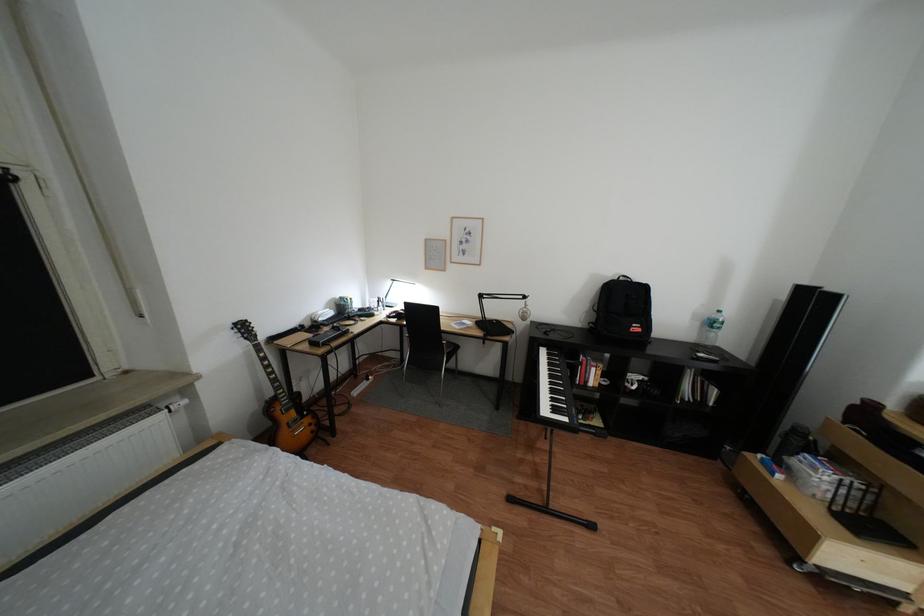
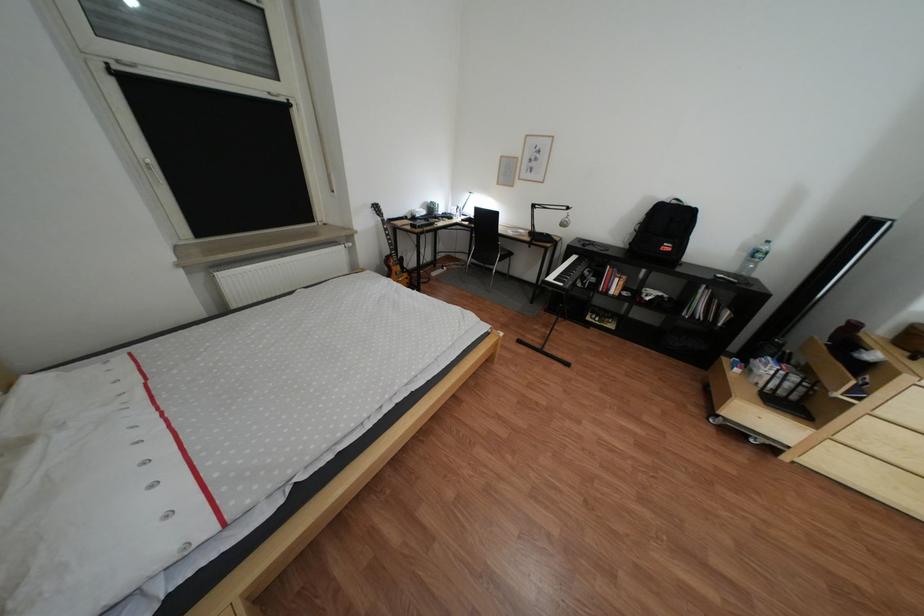
Locate, in the second image, the point that corresponds to [713,325] in the first image.

(760, 256)